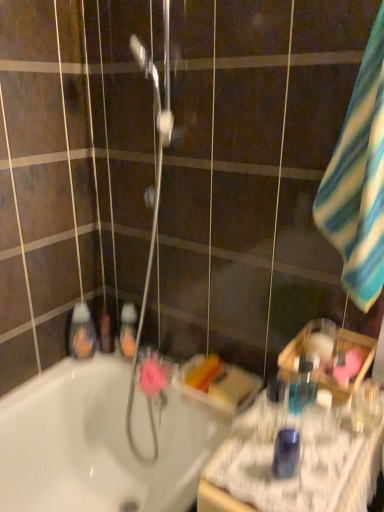
Question: Can you confirm if clear plastic bottle at right, the fifth mouthwash from the back, is smaller than translucent orange liquid at center, which is counted as the 4th mouthwash, starting from the front?

Choices:
 (A) no
 (B) yes

Answer: (B)

Question: Considering the relative sizes of clear plastic bottle at right, placed as the 1th mouthwash when sorted from right to left, and translucent orange liquid at center, the fourth mouthwash viewed from the right, in the image provided, is clear plastic bottle at right, placed as the 1th mouthwash when sorted from right to left, thinner than translucent orange liquid at center, the fourth mouthwash viewed from the right,?

Choices:
 (A) no
 (B) yes

Answer: (B)

Question: Is clear plastic bottle at right, placed as the 1th mouthwash when sorted from right to left, not near translucent orange liquid at center, which is counted as the 4th mouthwash, starting from the front?

Choices:
 (A) yes
 (B) no

Answer: (B)

Question: Is clear plastic bottle at right, placed as the 1th mouthwash when sorted from right to left, facing towards translucent orange liquid at center, which is counted as the 4th mouthwash, starting from the front?

Choices:
 (A) no
 (B) yes

Answer: (A)

Question: Is clear plastic bottle at right, the fifth mouthwash from the back, to the left of translucent orange liquid at center, which is counted as the 4th mouthwash, starting from the front, from the viewer's perspective?

Choices:
 (A) no
 (B) yes

Answer: (A)

Question: Considering the relative positions of translucent plastic basket at right and translucent orange liquid at center, the fourth mouthwash viewed from the right, in the image provided, is translucent plastic basket at right to the left or to the right of translucent orange liquid at center, the fourth mouthwash viewed from the right,?

Choices:
 (A) right
 (B) left

Answer: (A)

Question: Is point (256, 467) positioned closer to the camera than point (120, 317)?

Choices:
 (A) farther
 (B) closer

Answer: (B)

Question: Is translucent plastic basket at right spatially inside translucent orange liquid at center, which is counted as the 4th mouthwash, starting from the front, or outside of it?

Choices:
 (A) inside
 (B) outside

Answer: (B)

Question: In terms of size, does translucent plastic basket at right appear bigger or smaller than translucent orange liquid at center, which is counted as the 4th mouthwash, starting from the front?

Choices:
 (A) big
 (B) small

Answer: (A)

Question: Looking at their shapes, would you say blue plastic mouthwash at right, the first mouthwash in the front-to-back sequence, is wider or thinner than translucent plastic basket at right?

Choices:
 (A) wide
 (B) thin

Answer: (B)

Question: Relative to translucent plastic basket at right, is blue plastic mouthwash at right, positioned as the third mouthwash in right-to-left order, in front or behind?

Choices:
 (A) behind
 (B) front

Answer: (A)

Question: Considering the relative positions of blue plastic mouthwash at right, positioned as the fourth mouthwash in left-to-right order, and translucent plastic basket at right in the image provided, is blue plastic mouthwash at right, positioned as the fourth mouthwash in left-to-right order, to the left or to the right of translucent plastic basket at right?

Choices:
 (A) left
 (B) right

Answer: (A)

Question: From a real-world perspective, is blue plastic mouthwash at right, which is the 6th mouthwash from back to front, physically located above or below translucent plastic basket at right?

Choices:
 (A) above
 (B) below

Answer: (A)

Question: In terms of height, does translucent plastic mouthwash at lower left, the 1th mouthwash in the back-to-front sequence, look taller or shorter compared to striped cotton towel at right?

Choices:
 (A) short
 (B) tall

Answer: (A)

Question: Does point (99, 344) appear closer or farther from the camera than point (379, 231)?

Choices:
 (A) farther
 (B) closer

Answer: (A)